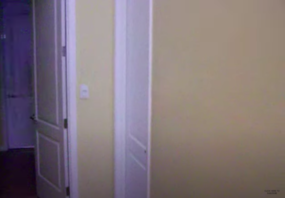
Locate an element on the screen. The height and width of the screenshot is (198, 285). floor is located at coordinates (13, 174).